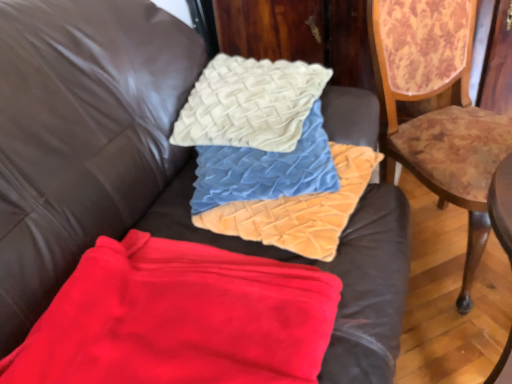
The image size is (512, 384). I want to click on blank space situated above velvet textured pillows at center, which is the 1th material in top-to-bottom order (from a real-world perspective), so click(x=275, y=161).